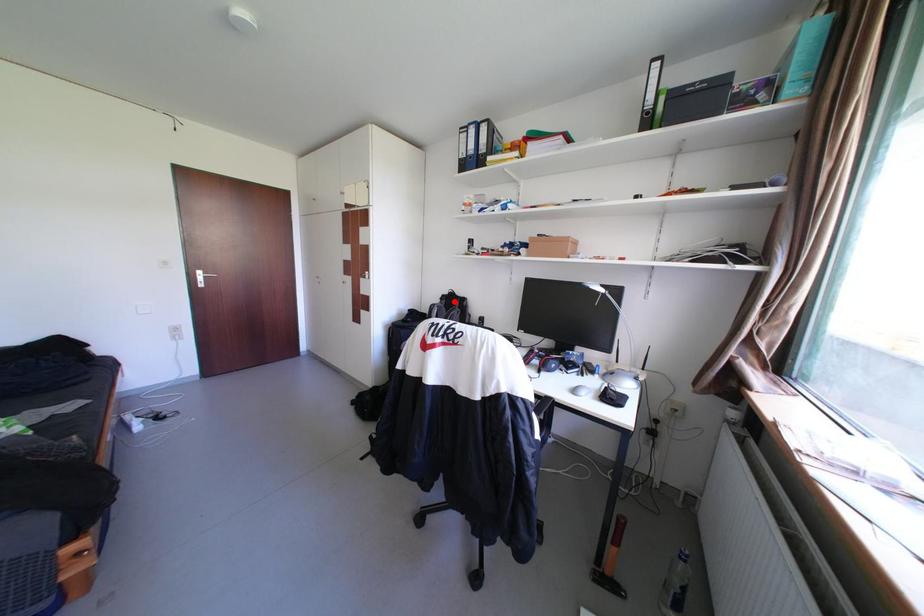
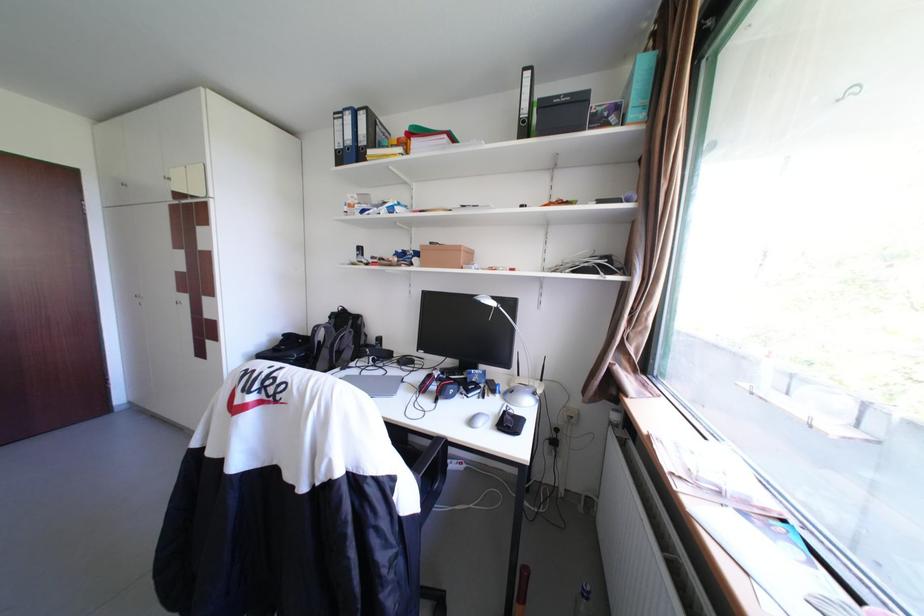
Question: I am providing you with two images of the same scene from different viewpoints. A red point is marked on the first image. Can you still see the location of the red point in image 2?

Choices:
 (A) Yes
 (B) No

Answer: (A)